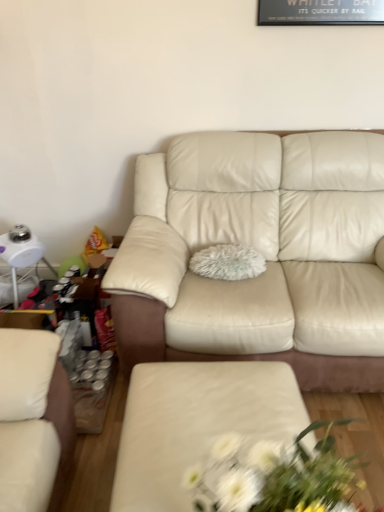
I want to click on fluffy white pillow at center, so click(228, 262).

Where is `cream leather couch at center`? This screenshot has height=512, width=384. cream leather couch at center is located at coordinates (245, 280).

Is fluffy white pillow at center positioned with its back to matte cream ottoman at center?

That's not correct — fluffy white pillow at center is not looking away from matte cream ottoman at center.

Which object is closer to the camera, fluffy white pillow at center or matte cream ottoman at center?

matte cream ottoman at center is more forward.

Is fluffy white pillow at center in contact with matte cream ottoman at center?

fluffy white pillow at center is not next to matte cream ottoman at center, and they're not touching.

Can you confirm if fluffy white pillow at center is positioned to the right of matte cream ottoman at center?

Correct, you'll find fluffy white pillow at center to the right of matte cream ottoman at center.

Is white fabric floral arrangement at center in front of matte cream ottoman at center?

Yes, white fabric floral arrangement at center is closer to the camera.

This screenshot has height=512, width=384. I want to click on floral arrangement above the matte cream ottoman at center (from the image's perspective), so click(275, 476).

From a real-world perspective, does white fabric floral arrangement at center sit lower than matte cream ottoman at center?

Actually, white fabric floral arrangement at center is physically above matte cream ottoman at center in the real world.

Locate an element on the screen. floral arrangement lying on the left of cream leather couch at center is located at coordinates [x=275, y=476].

In the scene shown: Are white fabric floral arrangement at center and cream leather couch at center far apart?

white fabric floral arrangement at center is positioned a significant distance from cream leather couch at center.

Which object is closer to the camera taking this photo, white fabric floral arrangement at center or cream leather couch at center?

Positioned in front is white fabric floral arrangement at center.

Is cream leather couch at center surrounding fluffy white pillow at center?

Absolutely, fluffy white pillow at center is inside cream leather couch at center.

From the picture: Does cream leather couch at center turn towards fluffy white pillow at center?

Yes, cream leather couch at center is facing fluffy white pillow at center.

Considering the sizes of objects cream leather couch at center and fluffy white pillow at center in the image provided, who is bigger, cream leather couch at center or fluffy white pillow at center?

cream leather couch at center.

How different are the orientations of cream leather couch at center and fluffy white pillow at center in degrees?

0.000403 degrees separate the facing orientations of cream leather couch at center and fluffy white pillow at center.

From a real-world perspective, is matte cream ottoman at center above or below cream leather couch at center?

matte cream ottoman at center is below cream leather couch at center.

Does matte cream ottoman at center have a greater width compared to cream leather couch at center?

In fact, matte cream ottoman at center might be narrower than cream leather couch at center.

Is matte cream ottoman at center beside cream leather couch at center?

matte cream ottoman at center is not next to cream leather couch at center, and they're not touching.

Does point (233, 416) appear closer or farther from the camera than point (173, 351)?

Point (233, 416) is closer to the camera than point (173, 351).

Can you confirm if matte cream ottoman at center is positioned to the right of fluffy white pillow at center?

Incorrect, matte cream ottoman at center is not on the right side of fluffy white pillow at center.

Could you tell me if matte cream ottoman at center is facing fluffy white pillow at center?

No, matte cream ottoman at center is not aimed at fluffy white pillow at center.

Considering the sizes of matte cream ottoman at center and fluffy white pillow at center in the image, is matte cream ottoman at center bigger or smaller than fluffy white pillow at center?

In the image, matte cream ottoman at center appears to be larger than fluffy white pillow at center.

Who is shorter, fluffy white pillow at center or cream leather couch at center?

Standing shorter between the two is fluffy white pillow at center.

Is fluffy white pillow at center turned away from cream leather couch at center?

That's right, fluffy white pillow at center is facing away from cream leather couch at center.

Does fluffy white pillow at center have a lesser width compared to cream leather couch at center?

Correct, the width of fluffy white pillow at center is less than that of cream leather couch at center.

How different are the orientations of fluffy white pillow at center and cream leather couch at center in degrees?

The facing directions of fluffy white pillow at center and cream leather couch at center are 0.000403 degrees apart.

Find the location of a particular element. This screenshot has width=384, height=512. pillow on the right side of matte cream ottoman at center is located at coordinates (228, 262).

Identify the location of couch behind the white fabric floral arrangement at center. (196, 423).

Looking at this image, considering their positions, is cream leather couch at center positioned closer to fluffy white pillow at center than white fabric floral arrangement at center?

Among the two, cream leather couch at center is located nearer to fluffy white pillow at center.

From the image, which object appears to be nearer to cream leather couch at center, matte cream ottoman at center or white fabric floral arrangement at center?

Among the two, matte cream ottoman at center is located nearer to cream leather couch at center.

From the image, which object appears to be farther from fluffy white pillow at center, white fabric floral arrangement at center or cream leather couch at center?

white fabric floral arrangement at center lies further to fluffy white pillow at center than the other object.

Based on their spatial positions, is cream leather couch at center or matte cream ottoman at center further from fluffy white pillow at center?

matte cream ottoman at center is positioned further to the anchor fluffy white pillow at center.

From the image, which object appears to be farther from cream leather couch at center, white fabric floral arrangement at center or matte cream ottoman at center?

white fabric floral arrangement at center is further to cream leather couch at center.

Estimate the real-world distances between objects in this image. Which object is closer to fluffy white pillow at center, matte cream ottoman at center or white fabric floral arrangement at center?

Among the two, matte cream ottoman at center is located nearer to fluffy white pillow at center.

When comparing their distances from fluffy white pillow at center, does matte cream ottoman at center or cream leather couch at center seem further?

matte cream ottoman at center lies further to fluffy white pillow at center than the other object.

Which object lies nearer to the anchor point matte cream ottoman at center, cream leather couch at center or fluffy white pillow at center?

The object closer to matte cream ottoman at center is cream leather couch at center.

Where is `couch located between white fabric floral arrangement at center and fluffy white pillow at center in the depth direction`? couch located between white fabric floral arrangement at center and fluffy white pillow at center in the depth direction is located at coordinates (196, 423).

This screenshot has width=384, height=512. Find the location of `studio couch positioned between matte cream ottoman at center and fluffy white pillow at center from near to far`. studio couch positioned between matte cream ottoman at center and fluffy white pillow at center from near to far is located at coordinates (245, 280).

Locate an element on the screen. studio couch positioned between white fabric floral arrangement at center and fluffy white pillow at center from near to far is located at coordinates (245, 280).

The height and width of the screenshot is (512, 384). In order to click on couch positioned between white fabric floral arrangement at center and cream leather couch at center from near to far in this screenshot , I will do `click(196, 423)`.